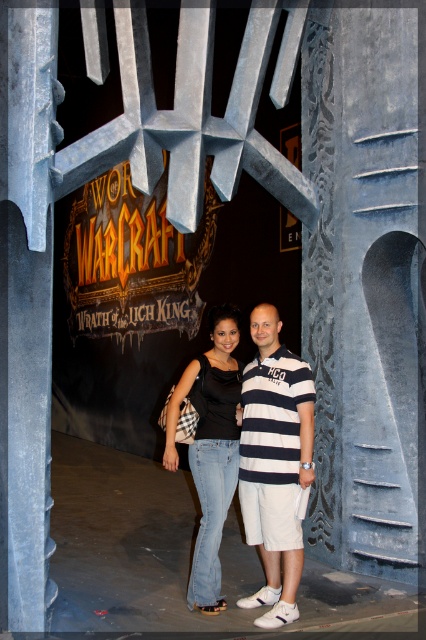
Looking at this image, you are a photographer setting up a shoot in front of the Wrath of the Lich King backdrop. You need to ensure that both the white striped polo shirt at center and the denim jeans at center are clearly visible in the photo. Since the backdrop is dark, you want to avoid any part of the subjects blending into it. Which clothing item should you focus on adjusting the lighting for to prevent it from merging with the dark backdrop?

The white striped polo shirt at center is closer to the viewer than the denim jeans at center. To prevent the white striped polo shirt at center from blending into the dark backdrop, you should focus on adjusting the lighting for it since it is closer and might cast a shadow or require more illumination to stand out against the dark background.